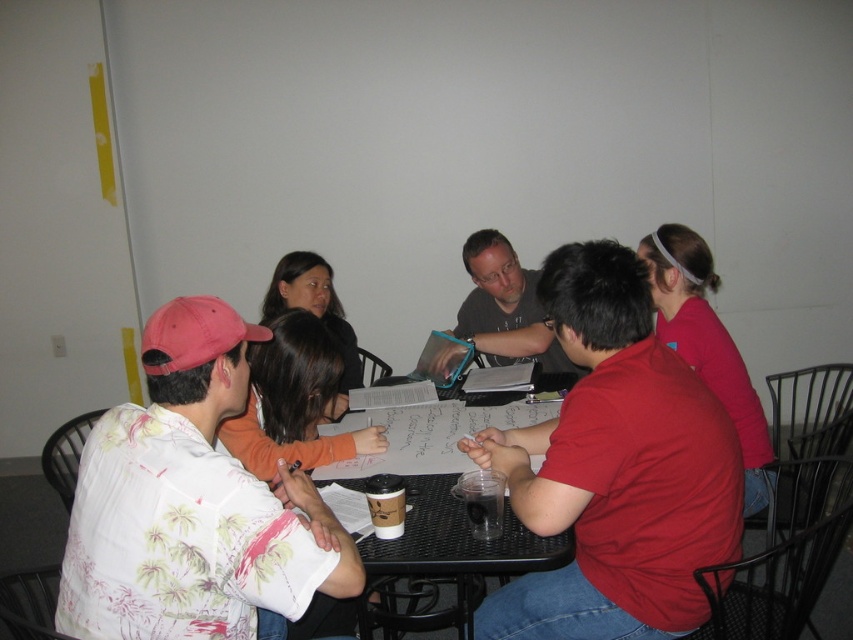
Question: Which point is closer to the camera?

Choices:
 (A) black plastic table at center
 (B) red matte shirt at center
 (C) white floral shirt at left
 (D) dark gray shirt at center

Answer: (C)

Question: In this image, where is red matte shirt at center located relative to white floral shirt at left?

Choices:
 (A) right
 (B) left

Answer: (A)

Question: Which of the following is the farthest from the observer?

Choices:
 (A) (589, 333)
 (B) (173, 612)
 (C) (495, 308)

Answer: (C)

Question: Which point appears closest to the camera in this image?

Choices:
 (A) (485, 547)
 (B) (140, 522)
 (C) (531, 284)

Answer: (B)

Question: From the image, what is the correct spatial relationship of red matte shirt at center in relation to white floral shirt at left?

Choices:
 (A) right
 (B) left

Answer: (A)

Question: Does red matte shirt at center have a lesser width compared to black plastic table at center?

Choices:
 (A) yes
 (B) no

Answer: (A)